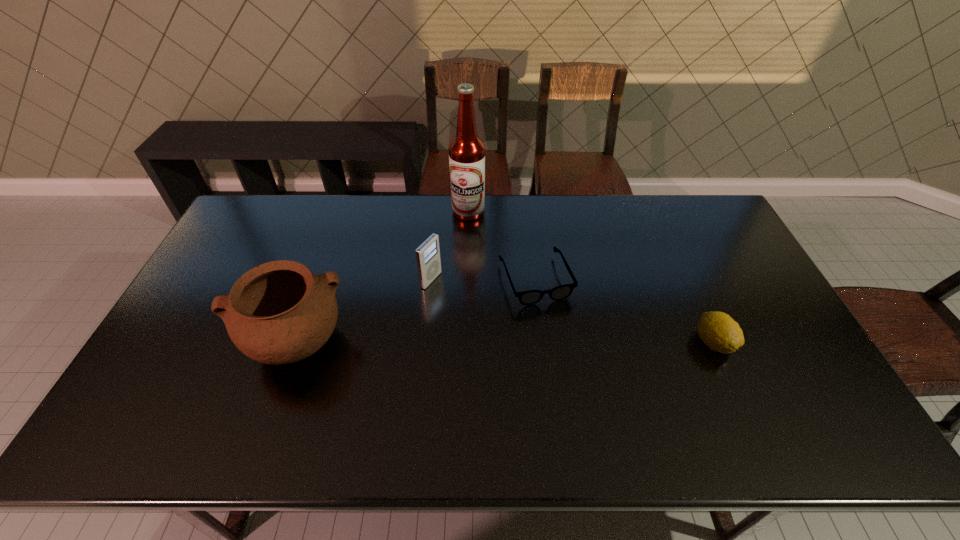
Locate an element on the screen. The image size is (960, 540). vacant space on the desktop that is between the second tallest object and the fourth tallest object and is positioned on the arms of the fourth object from left to right is located at coordinates (562, 342).

Where is `vacant spot on the desktop that is between the pottery and the second shortest object and is positioned on the front-facing side of the iPod`? Image resolution: width=960 pixels, height=540 pixels. vacant spot on the desktop that is between the pottery and the second shortest object and is positioned on the front-facing side of the iPod is located at coordinates (564, 342).

At what (x,y) coordinates should I click in order to perform the action: click on free spot on the desktop that is between the pottery and the second shortest object and is positioned on the label side of the third object from left to right. Please return your answer as a coordinate pair (x, y). The height and width of the screenshot is (540, 960). Looking at the image, I should click on (484, 342).